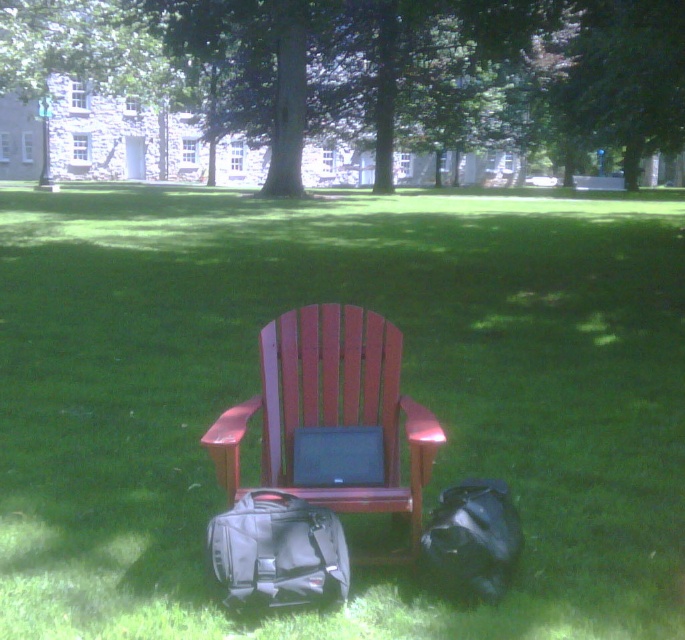
Question: Which of the following is the farthest from the observer?

Choices:
 (A) (292, 541)
 (B) (166, 356)
 (C) (456, 534)
 (D) (510, 134)

Answer: (D)

Question: Which of the following is the farthest from the observer?

Choices:
 (A) green grass at center
 (B) black matte bag at lower right

Answer: (B)

Question: Which is nearer to the black fabric backpack at lower left?

Choices:
 (A) matte black laptop at center
 (B) green leafy tree at upper center
 (C) green grass at center
 (D) black matte bag at lower right

Answer: (A)

Question: Is green grass at center to the left of wooden chair at center from the viewer's perspective?

Choices:
 (A) yes
 (B) no

Answer: (A)

Question: Is wooden chair at center positioned at the back of matte black laptop at center?

Choices:
 (A) no
 (B) yes

Answer: (A)

Question: Is black matte bag at lower right to the right of matte black laptop at center from the viewer's perspective?

Choices:
 (A) no
 (B) yes

Answer: (B)